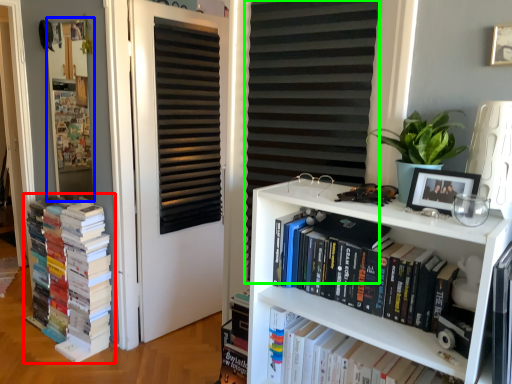
Question: Which is nearer to the book (highlighted by a red box)? bulletin board (highlighted by a blue box) or shutter (highlighted by a green box).

Choices:
 (A) bulletin board
 (B) shutter

Answer: (A)